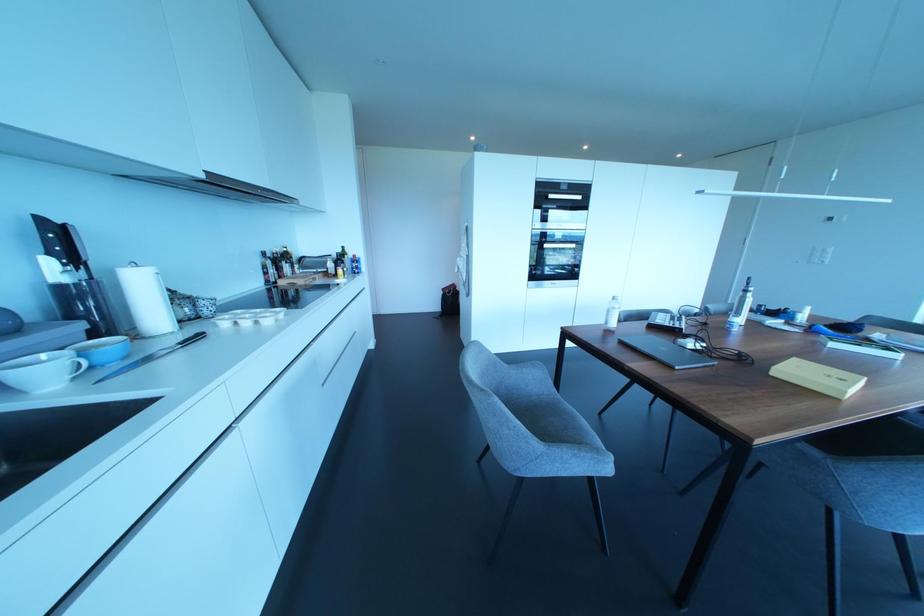
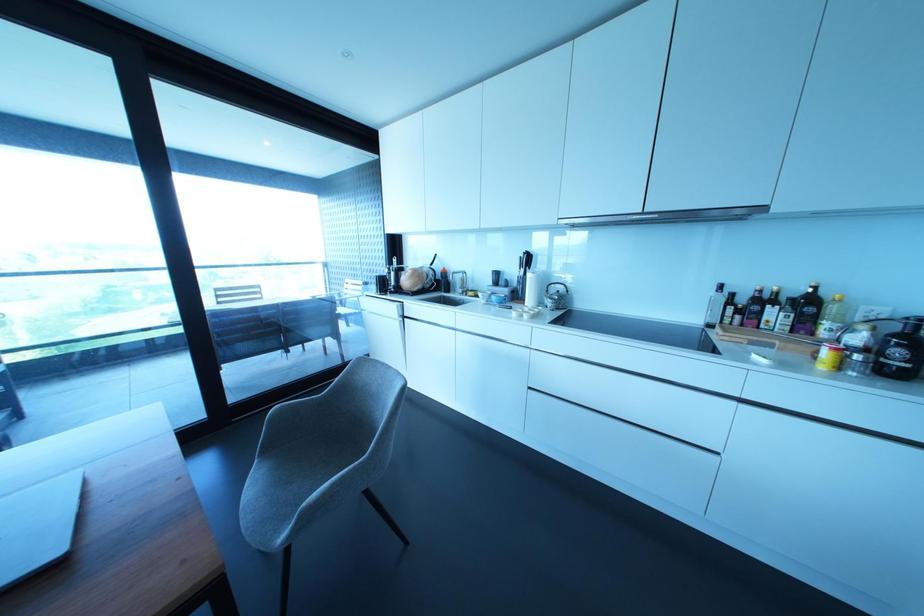
Where in the second image is the point corresponding to (339,270) from the first image?

(825, 353)